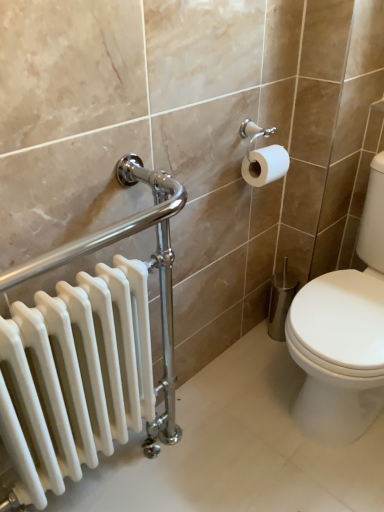
Where is `vacant area that lies between white glossy toilet at right and white glossy radiator at left`? This screenshot has height=512, width=384. vacant area that lies between white glossy toilet at right and white glossy radiator at left is located at coordinates (248, 435).